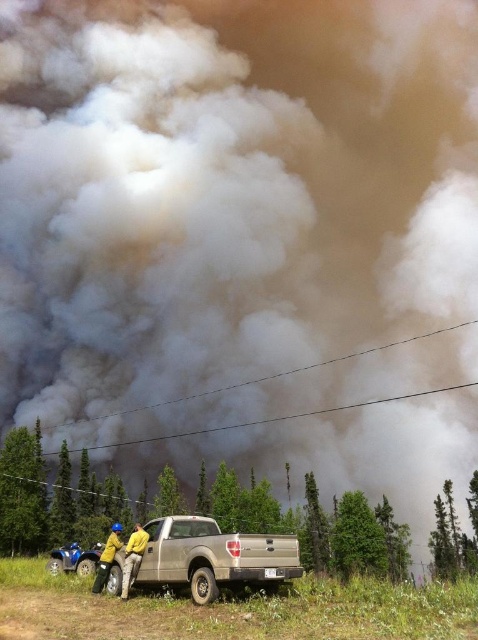
Does point (125, 552) come behind point (119, 547)?

No.

What do you see at coordinates (132, 557) in the screenshot? This screenshot has width=478, height=640. I see `yellow fabric person at lower center` at bounding box center [132, 557].

Is point (126, 554) behind point (119, 532)?

No, it is in front of (119, 532).

I want to click on yellow fabric person at lower center, so click(x=132, y=557).